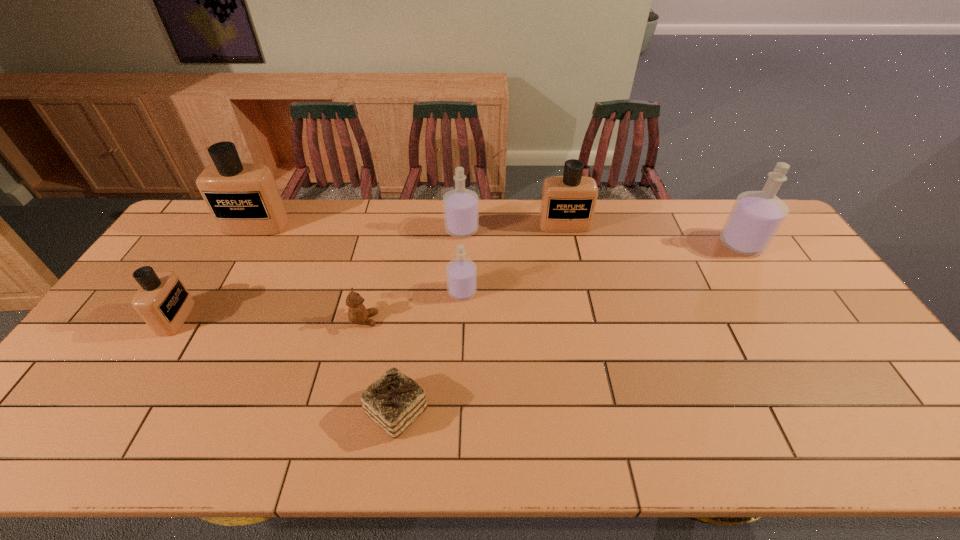
Identify the location of the rightmost purple perfume. The image size is (960, 540). (756, 216).

At what (x,y) coordinates should I click in order to perform the action: click on the rightmost perfume. Please return your answer as a coordinate pair (x, y). This screenshot has width=960, height=540. Looking at the image, I should click on click(x=756, y=216).

I want to click on the biggest beige perfume, so click(243, 198).

The height and width of the screenshot is (540, 960). I want to click on the second smallest purple perfume, so click(461, 206).

Locate an element on the screen. The height and width of the screenshot is (540, 960). the second smallest beige perfume is located at coordinates (568, 202).

I want to click on the second perfume from right to left, so click(568, 202).

At what (x,y) coordinates should I click in order to perform the action: click on the smallest beige perfume. Please return your answer as a coordinate pair (x, y). Looking at the image, I should click on (162, 301).

This screenshot has height=540, width=960. Identify the location of the nearest purple perfume. (461, 273).

Locate an element on the screen. brown teddy bear is located at coordinates (357, 313).

I want to click on the sixth object from right to left, so click(x=357, y=313).